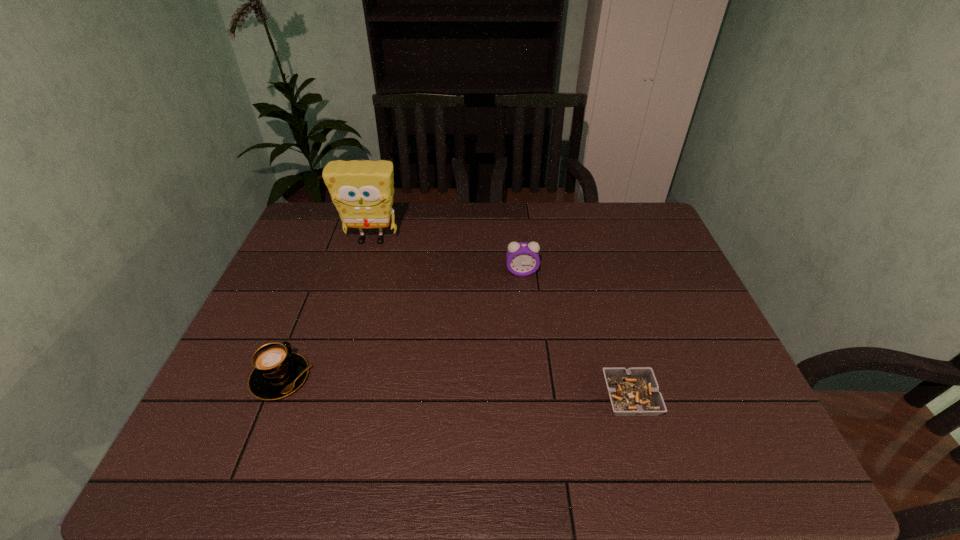
At what (x,y) coordinates should I click in order to perform the action: click on vacant area that lies between the ashtray and the farthest object. Please return your answer as a coordinate pair (x, y). Image resolution: width=960 pixels, height=540 pixels. Looking at the image, I should click on (x=501, y=319).

At what (x,y) coordinates should I click in order to perform the action: click on free point between the second object from right to left and the rightmost object. Please return your answer as a coordinate pair (x, y). The height and width of the screenshot is (540, 960). Looking at the image, I should click on (576, 335).

Where is `unoccupied area between the shortest object and the third object from left to right`? This screenshot has width=960, height=540. unoccupied area between the shortest object and the third object from left to right is located at coordinates (576, 335).

Identify the location of free space between the tallest object and the second shortest object. (326, 309).

Locate an element on the screen. This screenshot has width=960, height=540. vacant area between the rightmost object and the sponge is located at coordinates (501, 319).

I want to click on vacant space that's between the farthest object and the third nearest object, so click(x=446, y=256).

I want to click on free point between the second farthest object and the cappuccino, so click(401, 325).

This screenshot has height=540, width=960. Identify the location of unoccupied area between the second tallest object and the sponge. (446, 256).

This screenshot has width=960, height=540. In order to click on unoccupied area between the third tallest object and the third nearest object in this screenshot , I will do `click(401, 325)`.

Find the location of a particular element. This screenshot has width=960, height=540. empty space that is in between the ashtray and the sponge is located at coordinates (501, 319).